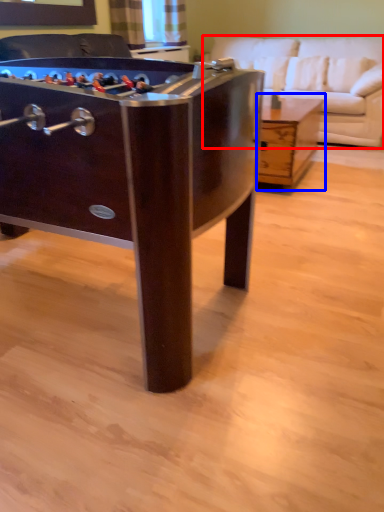
Question: Which point is further to the camera, studio couch (highlighted by a red box) or table (highlighted by a blue box)?

Choices:
 (A) studio couch
 (B) table

Answer: (A)